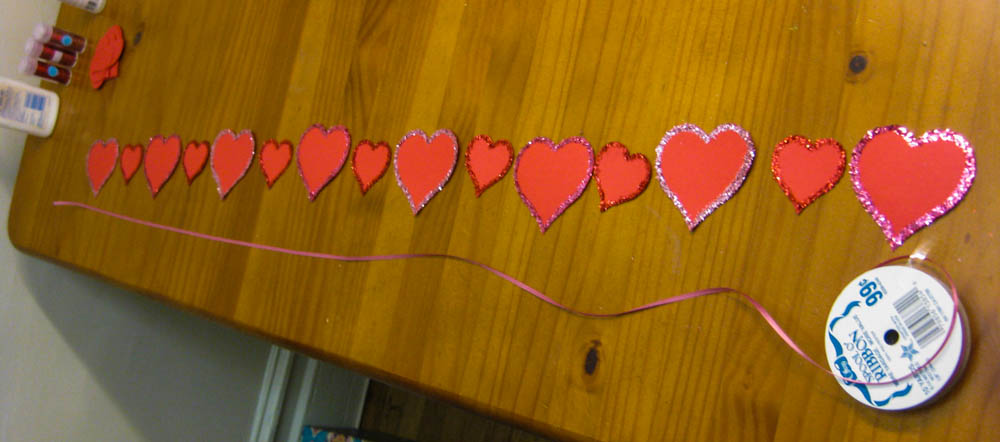
Where is `brown wood work table`? brown wood work table is located at coordinates (760, 51), (356, 283), (344, 47).